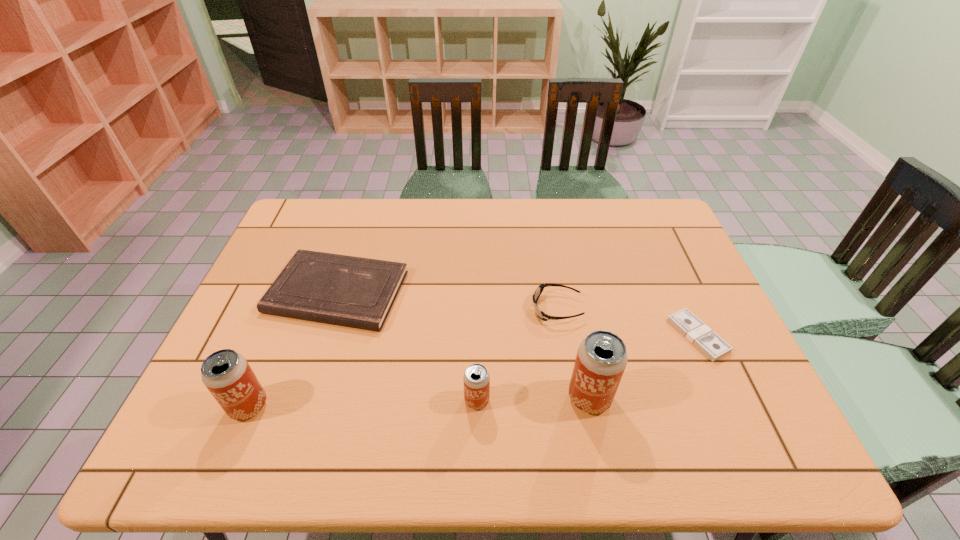
Please point a location where one more beer_can can be added evenly. Please provide its 2D coordinates. Your answer should be formatted as a tuple, i.e. [(x, y)], where the tuple contains the x and y coordinates of a point satisfying the conditions above.

[(363, 403)]